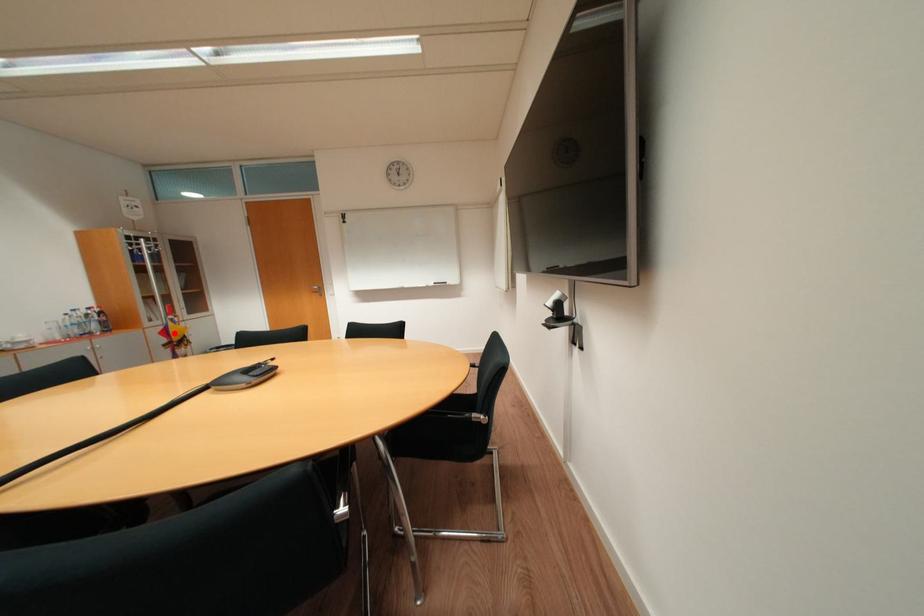
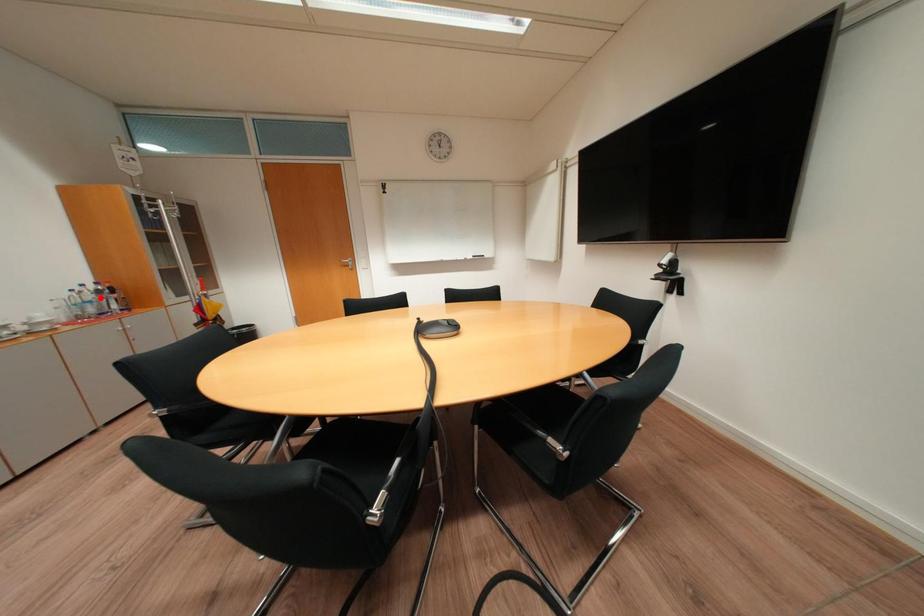
I am providing you with two images of the same scene from different viewpoints. A red point is marked on the first image and another point is marked on the second image. Are the points marked in image1 and image2 representing the same 3D position?

No